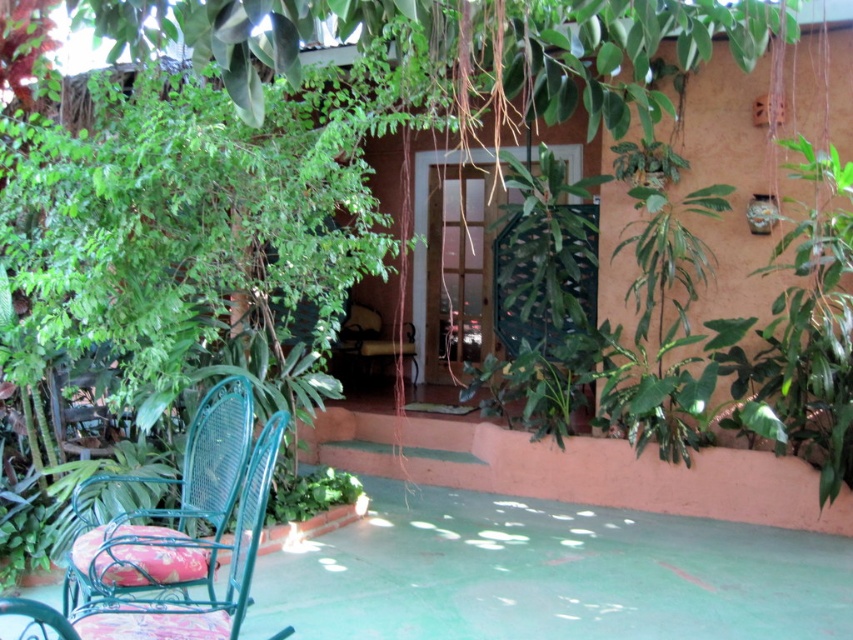
Question: Among these points, which one is farthest from the camera?

Choices:
 (A) (154, 528)
 (B) (366, 320)

Answer: (B)

Question: In this image, where is green wicker chair at lower left located relative to metallic green chair at center?

Choices:
 (A) above
 (B) below

Answer: (B)

Question: Does green wicker chair at lower left appear on the right side of metallic green chair at center?

Choices:
 (A) no
 (B) yes

Answer: (A)

Question: Which of the following is the farthest from the observer?

Choices:
 (A) green wicker chair at lower left
 (B) metallic green chair at center

Answer: (B)

Question: Is green wicker chair at lower left wider than metallic green chair at center?

Choices:
 (A) yes
 (B) no

Answer: (A)